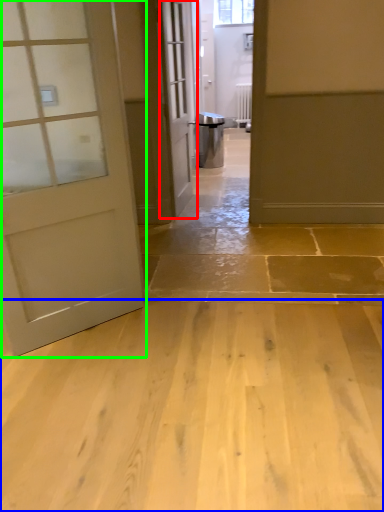
Question: Which object is the closest to the door (highlighted by a red box)? Choose among these: concrete (highlighted by a blue box) or door (highlighted by a green box).

Choices:
 (A) concrete
 (B) door

Answer: (B)